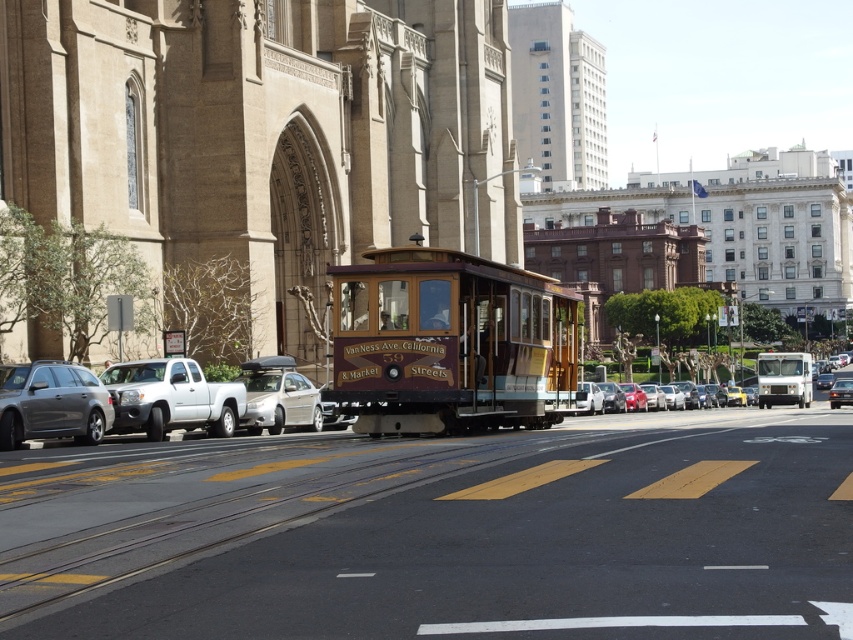
You are a GUI agent. You are given a task and a screenshot of the screen. Output one action in this format:
    pyautogui.click(x=<x>, y=<y>)
    Task: Click on the wooden polished cable car at center
    The height and width of the screenshot is (640, 853).
    Given the screenshot: What is the action you would take?
    pyautogui.click(x=450, y=342)

Locate an element on the screen. The image size is (853, 640). wooden polished cable car at center is located at coordinates (450, 342).

Does yellow asphalt track at center have a greater height compared to metallic silver sedan at center?

No, yellow asphalt track at center is not taller than metallic silver sedan at center.

Is yellow asphalt track at center above metallic silver sedan at center?

Yes.

Who is more distant from viewer, (74, 602) or (606, 394)?

Positioned behind is point (606, 394).

Identify the location of yellow asphalt track at center. Image resolution: width=853 pixels, height=640 pixels. (440, 532).

Between yellow asphalt track at center and matte gray station wagon at left, which one appears on the right side from the viewer's perspective?

Positioned to the right is yellow asphalt track at center.

Which of these two, yellow asphalt track at center or matte gray station wagon at left, stands taller?

matte gray station wagon at left is taller.

Where is `yellow asphalt track at center`? This screenshot has width=853, height=640. yellow asphalt track at center is located at coordinates (440, 532).